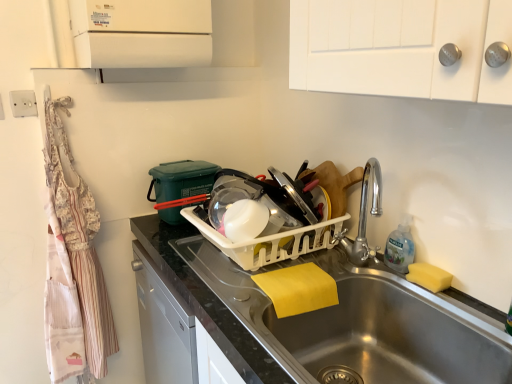
What is the approximate height of white floral apron at left?

white floral apron at left is 3.99 feet tall.

The width and height of the screenshot is (512, 384). I want to click on clear plastic bottle at sink right, so click(400, 246).

The width and height of the screenshot is (512, 384). Describe the element at coordinates (400, 246) in the screenshot. I see `clear plastic bottle at sink right` at that location.

This screenshot has width=512, height=384. Identify the location of white floral apron at left. (79, 239).

Are white glossy counter top at center and clear plastic bottle at sink right making contact?

There is a gap between white glossy counter top at center and clear plastic bottle at sink right.

Is white glossy counter top at center completely or partially outside of clear plastic bottle at sink right?

That's correct, white glossy counter top at center is outside of clear plastic bottle at sink right.

From a real-world perspective, who is located lower, white glossy counter top at center or clear plastic bottle at sink right?

white glossy counter top at center, from a real-world perspective.

Between yellow sponge at sink right and stainless steel sink at lower center, which one has larger width?

Wider between the two is stainless steel sink at lower center.

Is yellow sponge at sink right directly adjacent to stainless steel sink at lower center?

No, yellow sponge at sink right is not in contact with stainless steel sink at lower center.

In the scene shown: Who is more distant, yellow sponge at sink right or stainless steel sink at lower center?

yellow sponge at sink right is further from the camera.

Between point (407, 276) and point (406, 356), which one is positioned in front?

The point (406, 356) is closer to the camera.

Which object is further away from the camera, yellow sponge at sink right or white floral apron at left?

white floral apron at left is further from the camera.

In the scene shown: Looking at their sizes, would you say yellow sponge at sink right is wider or thinner than white floral apron at left?

Considering their sizes, yellow sponge at sink right looks slimmer than white floral apron at left.

In terms of width, does clear plastic bottle at sink right look wider or thinner when compared to yellow sponge at sink right?

Clearly, clear plastic bottle at sink right has more width compared to yellow sponge at sink right.

Does clear plastic bottle at sink right contain yellow sponge at sink right?

No.

Identify the location of soap in front of the clear plastic bottle at sink right. Image resolution: width=512 pixels, height=384 pixels. (429, 276).

Between clear plastic bottle at sink right and yellow sponge at sink right, which one has larger size?

clear plastic bottle at sink right.

Consider the image. Are clear plastic bottle at sink right and white plastic dish rack at center beside each other?

No, clear plastic bottle at sink right is not in contact with white plastic dish rack at center.

Which of these two, clear plastic bottle at sink right or white plastic dish rack at center, stands shorter?

white plastic dish rack at center.

Considering the positions of objects clear plastic bottle at sink right and white plastic dish rack at center in the image provided, who is more to the left, clear plastic bottle at sink right or white plastic dish rack at center?

white plastic dish rack at center is more to the left.

Considering the sizes of objects clear plastic bottle at sink right and white plastic dish rack at center in the image provided, who is bigger, clear plastic bottle at sink right or white plastic dish rack at center?

With larger size is white plastic dish rack at center.

Which object is further away from the camera, white plastic dish rack at center or stainless steel sink at lower center?

white plastic dish rack at center.

Which object is positioned more to the right, white plastic dish rack at center or stainless steel sink at lower center?

stainless steel sink at lower center.

How distant is white plastic dish rack at center from stainless steel sink at lower center?

white plastic dish rack at center and stainless steel sink at lower center are 11.10 inches apart from each other.

Is white plastic dish rack at center not within stainless steel sink at lower center?

Indeed, white plastic dish rack at center is completely outside stainless steel sink at lower center.

Between clear plastic bottle at sink right and stainless steel sink at lower center, which one has smaller width?

clear plastic bottle at sink right is thinner.

Is point (409, 255) positioned before point (340, 285)?

Yes, it is.

Identify the location of sink that is in front of the clear plastic bottle at sink right. The image size is (512, 384). (395, 334).

Image resolution: width=512 pixels, height=384 pixels. I want to click on counter top located in front of the clear plastic bottle at sink right, so click(x=207, y=302).

Find the location of a particular element. The width and height of the screenshot is (512, 384). soap behind the stainless steel sink at lower center is located at coordinates (429, 276).

From the image, which object appears to be nearer to white plastic dish rack at center, stainless steel sink at lower center or white glossy counter top at center?

white glossy counter top at center is positioned closer to the anchor white plastic dish rack at center.

When comparing their distances from white glossy counter top at center, does yellow sponge at sink right or stainless steel sink at lower center seem closer?

stainless steel sink at lower center is closer to white glossy counter top at center.

Based on their spatial positions, is white floral apron at left or yellow sponge at sink right closer to white plastic dish rack at center?

yellow sponge at sink right is positioned closer to the anchor white plastic dish rack at center.

Considering their positions, is white plastic dish rack at center positioned further to stainless steel sink at lower center than clear plastic bottle at sink right?

white plastic dish rack at center is positioned further to the anchor stainless steel sink at lower center.

Which object lies further to the anchor point white glossy counter top at center, white plastic dish rack at center or clear plastic bottle at sink right?

Among the two, clear plastic bottle at sink right is located further to white glossy counter top at center.

When comparing their distances from white floral apron at left, does white glossy counter top at center or stainless steel sink at lower center seem further?

stainless steel sink at lower center.

Looking at the image, which one is located further to yellow sponge at sink right, stainless steel sink at lower center or white plastic dish rack at center?

white plastic dish rack at center lies further to yellow sponge at sink right than the other object.

From the image, which object appears to be nearer to clear plastic bottle at sink right, stainless steel sink at lower center or white glossy counter top at center?

stainless steel sink at lower center lies closer to clear plastic bottle at sink right than the other object.

This screenshot has height=384, width=512. Find the location of `counter top located between stainless steel sink at lower center and clear plastic bottle at sink right in the depth direction`. counter top located between stainless steel sink at lower center and clear plastic bottle at sink right in the depth direction is located at coordinates (207, 302).

Image resolution: width=512 pixels, height=384 pixels. I want to click on appliance between white glossy counter top at center and yellow sponge at sink right from left to right, so click(271, 241).

Locate an element on the screen. The image size is (512, 384). counter top between stainless steel sink at lower center and white plastic dish rack at center in the front-back direction is located at coordinates (207, 302).

Locate an element on the screen. The width and height of the screenshot is (512, 384). soap between stainless steel sink at lower center and clear plastic bottle at sink right from front to back is located at coordinates (429, 276).